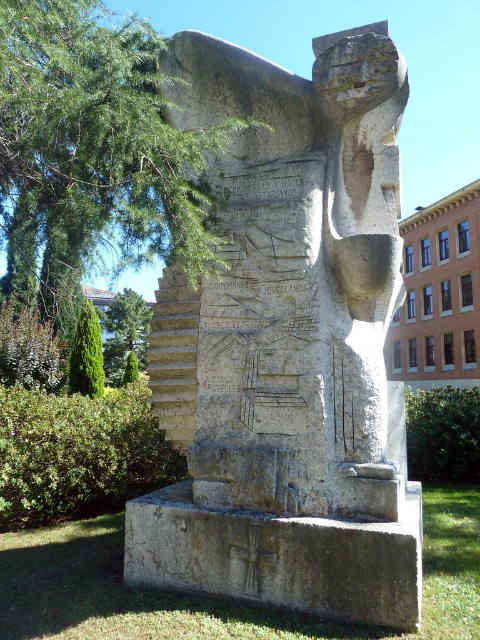
You are a photographer planning to take a picture of the stone monument. You notice two green leafy trees in the scene. Which tree, the green leafy tree at upper left or the green leafy tree at lower left, would appear wider in the photo?

The green leafy tree at upper left appears wider in the photo because its width is larger than that of the green leafy tree at lower left.